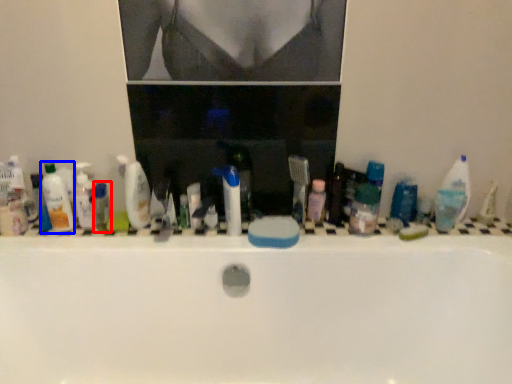
Question: Among these objects, which one is farthest to the camera, toiletry (highlighted by a red box) or mouthwash (highlighted by a blue box)?

Choices:
 (A) toiletry
 (B) mouthwash

Answer: (A)